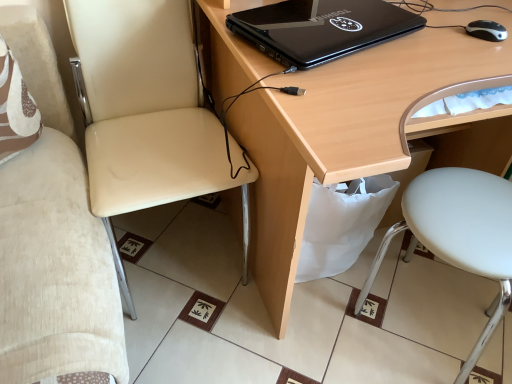
Question: Is beige leather chair at left, which is the first chair from left to right, bigger than light wood desk at center?

Choices:
 (A) no
 (B) yes

Answer: (A)

Question: From a real-world perspective, is beige leather chair at left, which is the 2th chair in right-to-left order, on top of light wood desk at center?

Choices:
 (A) yes
 (B) no

Answer: (B)

Question: Considering the relative sizes of beige leather chair at left, which is the 2th chair in right-to-left order, and light wood desk at center in the image provided, is beige leather chair at left, which is the 2th chair in right-to-left order, taller than light wood desk at center?

Choices:
 (A) no
 (B) yes

Answer: (A)

Question: Considering the relative sizes of beige leather chair at left, which is the 2th chair in right-to-left order, and light wood desk at center in the image provided, is beige leather chair at left, which is the 2th chair in right-to-left order, shorter than light wood desk at center?

Choices:
 (A) yes
 (B) no

Answer: (A)

Question: Does beige leather chair at left, which is the 2th chair in right-to-left order, appear on the left side of light wood desk at center?

Choices:
 (A) yes
 (B) no

Answer: (A)

Question: Is beige leather chair at left, which is the 2th chair in right-to-left order, positioned in front of light wood desk at center?

Choices:
 (A) yes
 (B) no

Answer: (B)

Question: Is the position of black matte laptop at upper center less distant than that of light wood desk at center?

Choices:
 (A) no
 (B) yes

Answer: (A)

Question: Can you confirm if black matte laptop at upper center is smaller than light wood desk at center?

Choices:
 (A) no
 (B) yes

Answer: (B)

Question: Can you see black matte laptop at upper center touching light wood desk at center?

Choices:
 (A) no
 (B) yes

Answer: (A)

Question: Is there a large distance between black matte laptop at upper center and light wood desk at center?

Choices:
 (A) no
 (B) yes

Answer: (A)

Question: Can light wood desk at center be found inside black matte laptop at upper center?

Choices:
 (A) no
 (B) yes

Answer: (A)

Question: From the image's perspective, is black matte laptop at upper center beneath light wood desk at center?

Choices:
 (A) no
 (B) yes

Answer: (A)

Question: Considering the relative sizes of light wood desk at center and white matte stool at lower right, the 1th chair from the right, in the image provided, is light wood desk at center taller than white matte stool at lower right, the 1th chair from the right,?

Choices:
 (A) yes
 (B) no

Answer: (A)